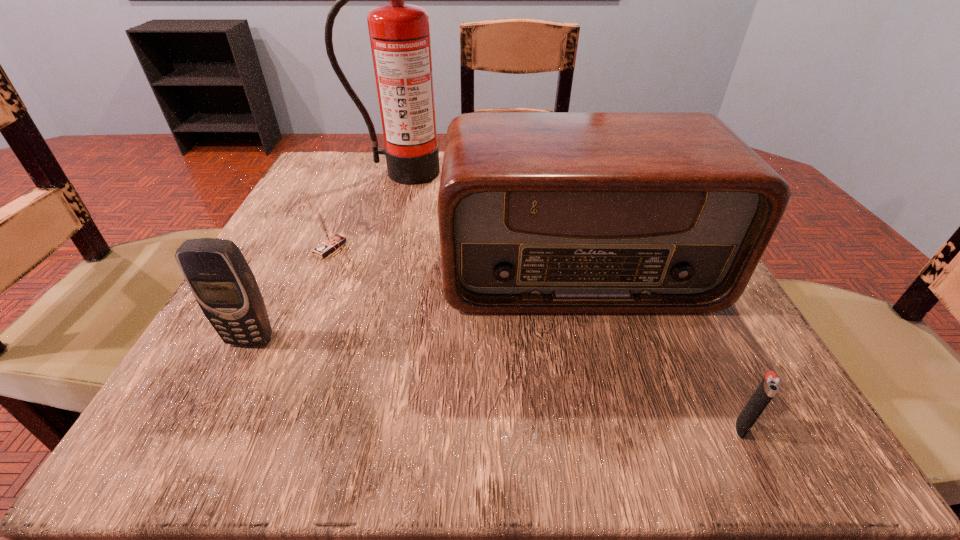
Find the location of a particular element. object at the near right corner is located at coordinates (770, 384).

In the image, there is a desktop. Where is `vacant space at the far edge`? vacant space at the far edge is located at coordinates (431, 198).

The image size is (960, 540). In order to click on free point at the near edge in this screenshot , I will do `click(334, 446)`.

Find the location of `vacant space at the right edge of the desktop`. vacant space at the right edge of the desktop is located at coordinates (673, 326).

The image size is (960, 540). Find the location of `free space between the second tallest object and the third tallest object`. free space between the second tallest object and the third tallest object is located at coordinates (414, 305).

Find the location of a particular element. unoccupied area between the fourth shortest object and the nearest object is located at coordinates (660, 349).

Identify the location of unoccupied area between the third tallest object and the nearest object. (496, 383).

Identify the location of free space that is in between the nearest object and the fourth shortest object. This screenshot has width=960, height=540. (660, 349).

Where is `vacant point located between the cellular telephone and the second tallest object`? vacant point located between the cellular telephone and the second tallest object is located at coordinates (414, 305).

The width and height of the screenshot is (960, 540). In order to click on unoccupied area between the cellular telephone and the radio receiver in this screenshot , I will do `click(414, 305)`.